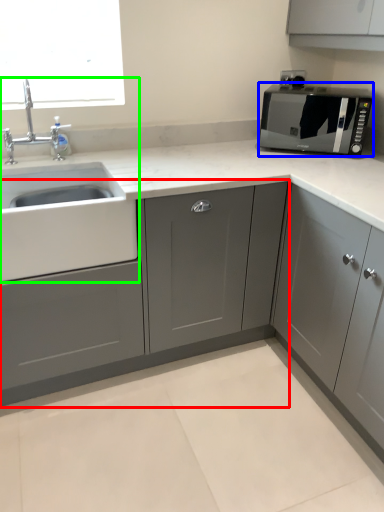
Question: Which is farther away from cabinetry (highlighted by a red box)? microwave oven (highlighted by a blue box) or sink (highlighted by a green box)?

Choices:
 (A) microwave oven
 (B) sink

Answer: (A)